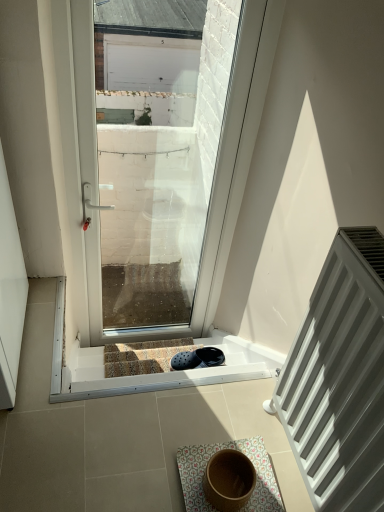
Question: Is carpeted stairs at center inside white matte radiator at right?

Choices:
 (A) no
 (B) yes

Answer: (A)

Question: From the image's perspective, is white matte radiator at right beneath carpeted stairs at center?

Choices:
 (A) yes
 (B) no

Answer: (B)

Question: Considering the relative sizes of white matte radiator at right and carpeted stairs at center in the image provided, is white matte radiator at right bigger than carpeted stairs at center?

Choices:
 (A) yes
 (B) no

Answer: (A)

Question: Could you tell me if white matte radiator at right is facing carpeted stairs at center?

Choices:
 (A) no
 (B) yes

Answer: (A)

Question: Is white matte radiator at right positioned with its back to carpeted stairs at center?

Choices:
 (A) yes
 (B) no

Answer: (B)

Question: From a real-world perspective, relative to white matte radiator at right, is transparent glass door at center vertically above or below?

Choices:
 (A) below
 (B) above

Answer: (A)

Question: Is point (x=170, y=3) closer or farther from the camera than point (x=340, y=276)?

Choices:
 (A) farther
 (B) closer

Answer: (A)

Question: Is transparent glass door at center inside the boundaries of white matte radiator at right, or outside?

Choices:
 (A) outside
 (B) inside

Answer: (A)

Question: Is transparent glass door at center wider or thinner than white matte radiator at right?

Choices:
 (A) thin
 (B) wide

Answer: (B)

Question: Is transparent glass door at center bigger or smaller than carpeted stairs at center?

Choices:
 (A) big
 (B) small

Answer: (A)

Question: Is point (102, 190) closer or farther from the camera than point (190, 349)?

Choices:
 (A) closer
 (B) farther

Answer: (B)

Question: Looking at their shapes, would you say transparent glass door at center is wider or thinner than carpeted stairs at center?

Choices:
 (A) wide
 (B) thin

Answer: (A)

Question: From a real-world perspective, is transparent glass door at center physically located above or below carpeted stairs at center?

Choices:
 (A) above
 (B) below

Answer: (A)

Question: Is white matte radiator at right wider or thinner than floral fabric bath mat at center?

Choices:
 (A) thin
 (B) wide

Answer: (A)

Question: Would you say white matte radiator at right is to the left or to the right of floral fabric bath mat at center in the picture?

Choices:
 (A) right
 (B) left

Answer: (A)